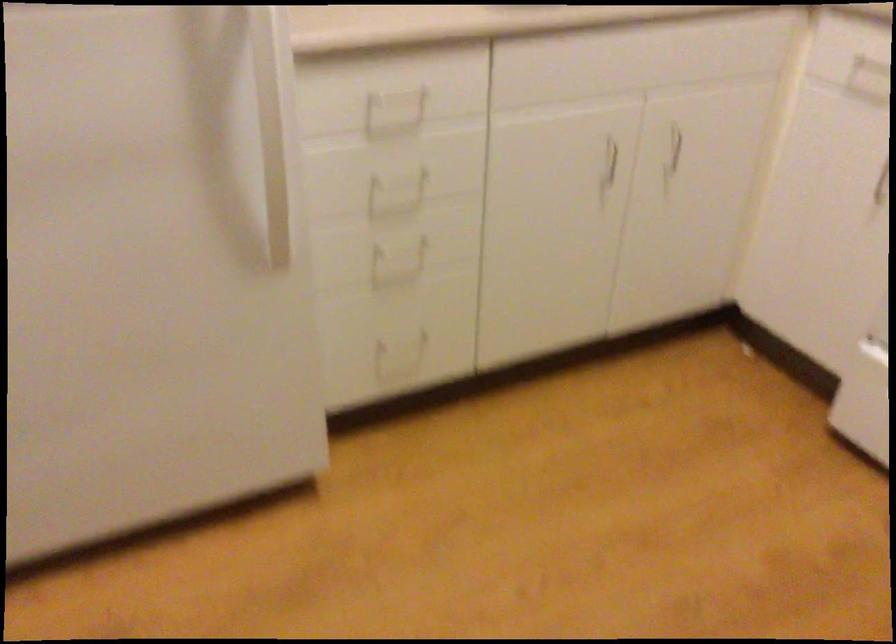
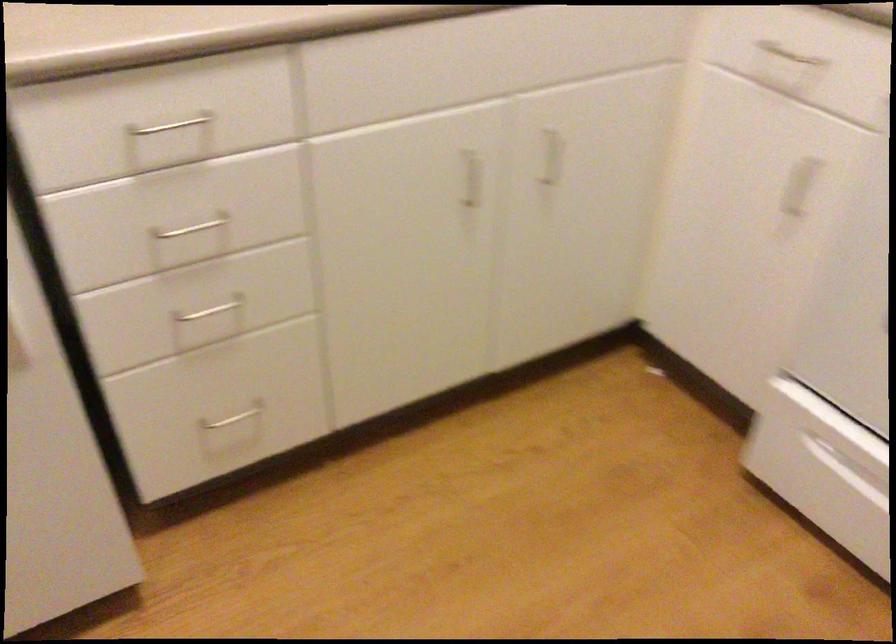
Find the pixel in the second image that matches the point at 395,250 in the first image.

(211, 310)